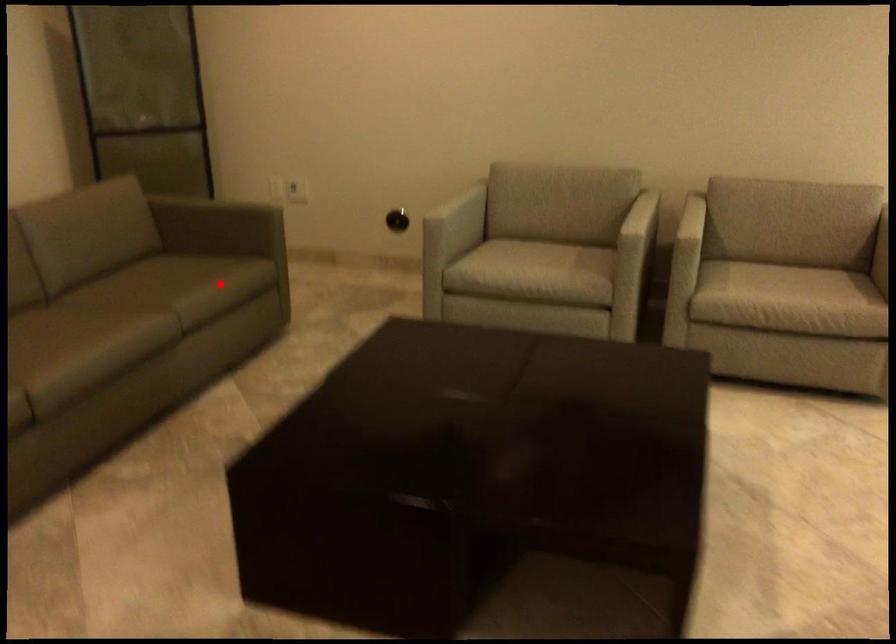
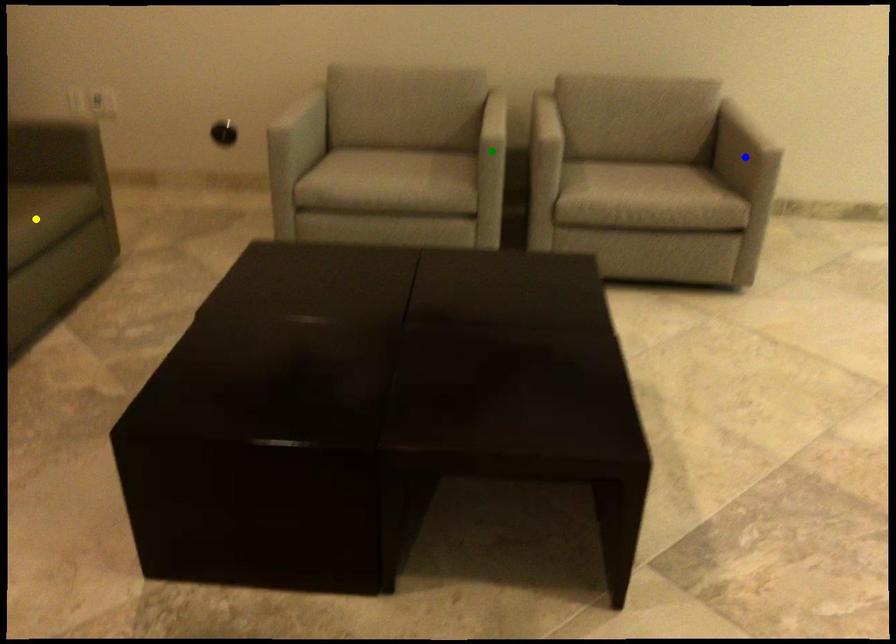
Question: I am providing you with two images of the same scene from different viewpoints. A red point is marked on the first image. You are given multiple points on the second image. In image 2, which mark is for the same physical point as the one in image 1?

Choices:
 (A) yellow point
 (B) blue point
 (C) green point

Answer: (A)